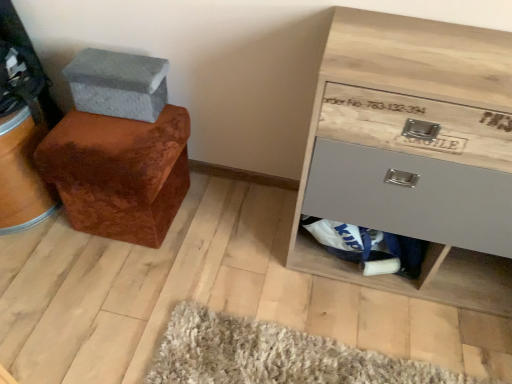
Find the location of a particular element. The height and width of the screenshot is (384, 512). vacant area that lies to the right of velvet brown ottoman at left is located at coordinates (224, 225).